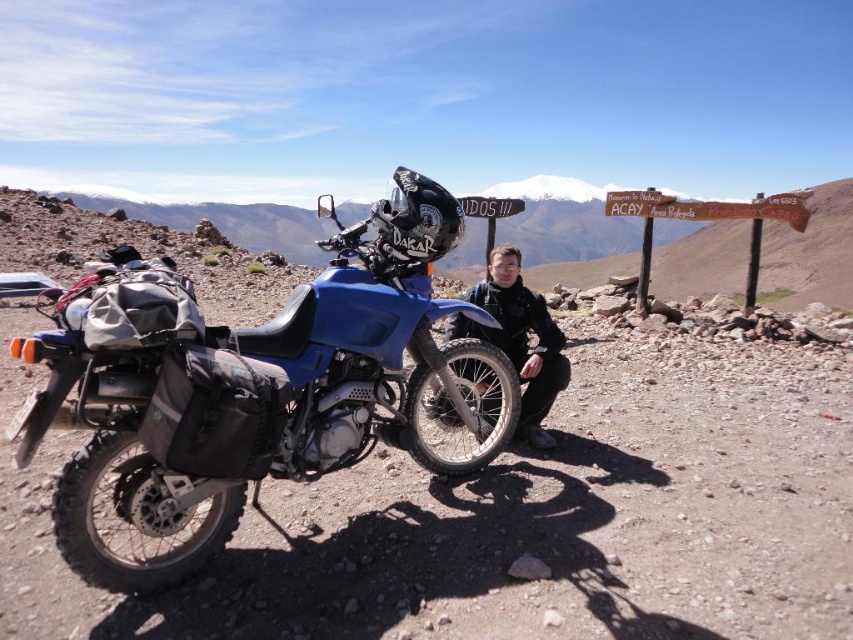
Between point (335, 572) and point (129, 317), which one is positioned behind?

Point (335, 572)

Is blue rubber tire at lower left closer to camera compared to blue matte/synthetic motorcycle at center?

No, it is not.

Locate an element on the screen. This screenshot has height=640, width=853. blue rubber tire at lower left is located at coordinates (515, 516).

Consider the image. Can you confirm if blue matte/synthetic motorcycle at center is positioned to the left of black matte jacket at center?

Correct, you'll find blue matte/synthetic motorcycle at center to the left of black matte jacket at center.

Between point (218, 492) and point (468, 337), which one is positioned behind?

The point (468, 337) is more distant.

You are a GUI agent. You are given a task and a screenshot of the screen. Output one action in this format:
    pyautogui.click(x=<x>, y=<y>)
    Task: Click on the blue matte/synthetic motorcycle at center
    This screenshot has width=853, height=640.
    Given the screenshot: What is the action you would take?
    pyautogui.click(x=247, y=385)

Can you confirm if blue rubber tire at lower left is wider than black matte jacket at center?

Correct, the width of blue rubber tire at lower left exceeds that of black matte jacket at center.

Does blue rubber tire at lower left have a lesser width compared to black matte jacket at center?

No.

Image resolution: width=853 pixels, height=640 pixels. I want to click on blue rubber tire at lower left, so click(515, 516).

Where is `blue rubber tire at lower left`? This screenshot has height=640, width=853. blue rubber tire at lower left is located at coordinates (515, 516).